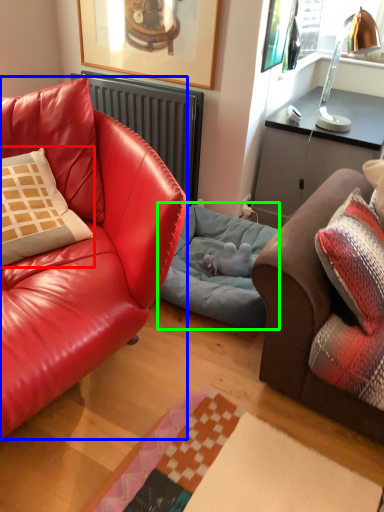
Question: Considering the real-world distances, which object is farthest from pillow (highlighted by a red box)? studio couch (highlighted by a blue box) or dog bed (highlighted by a green box)?

Choices:
 (A) studio couch
 (B) dog bed

Answer: (B)